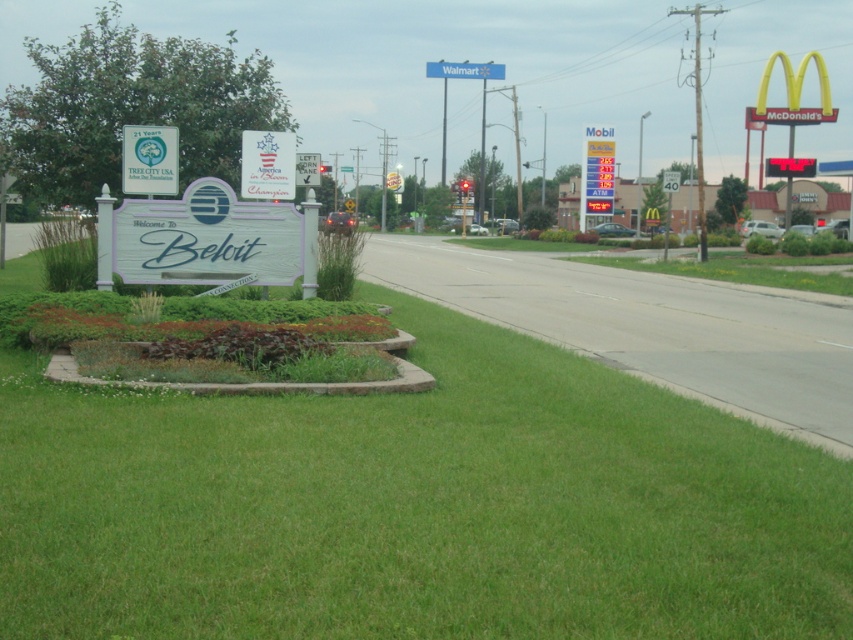
In the scene shown: Does green grass at lower center appear over metallic silver speed limit sign at right?

Result: No, green grass at lower center is not above metallic silver speed limit sign at right.

Does point (322, 477) come in front of point (663, 172)?

Yes, it is in front of point (663, 172).

Identify the location of green grass at lower center. This screenshot has width=853, height=640. (415, 506).

Image resolution: width=853 pixels, height=640 pixels. I want to click on green grass at lower center, so click(415, 506).

Is white plastic sign at center bigger than red plastic gas price sign at right?

Incorrect, white plastic sign at center is not larger than red plastic gas price sign at right.

Who is taller, white plastic sign at center or red plastic gas price sign at right?

With more height is red plastic gas price sign at right.

Identify the location of white plastic sign at center. (267, 164).

Is green grass at lower center to the right of white plastic sign at center from the viewer's perspective?

Indeed, green grass at lower center is positioned on the right side of white plastic sign at center.

Between green grass at lower center and white plastic sign at center, which one has less height?

white plastic sign at center is shorter.

Where is `green grass at lower center`? green grass at lower center is located at coordinates (415, 506).